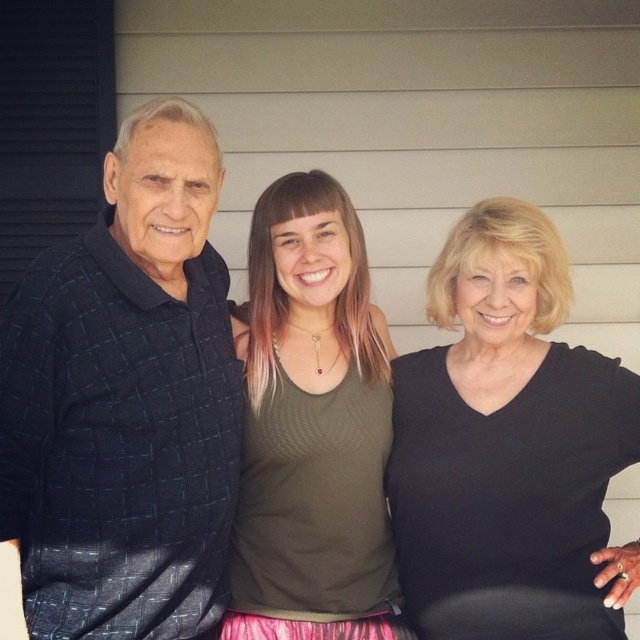
Which is behind, point (120, 188) or point (336, 388)?

The point (336, 388) is more distant.

Between dark blue textured polo shirt at left and green fabric tank top at center, which one has more height?

dark blue textured polo shirt at left

Find the location of a particular element. dark blue textured polo shirt at left is located at coordinates (125, 401).

Is black matte shirt at right to the right of green fabric tank top at center from the viewer's perspective?

Correct, you'll find black matte shirt at right to the right of green fabric tank top at center.

Does black matte shirt at right come behind green fabric tank top at center?

No, it is in front of green fabric tank top at center.

Identify the location of black matte shirt at right. This screenshot has width=640, height=640. (508, 448).

Does dark blue textured polo shirt at left have a larger size compared to black matte shirt at right?

No.

Is dark blue textured polo shirt at left shorter than black matte shirt at right?

No.

Between point (45, 365) and point (509, 541), which one is positioned behind?

The point (509, 541) is behind.

The height and width of the screenshot is (640, 640). In order to click on dark blue textured polo shirt at left in this screenshot , I will do `click(125, 401)`.